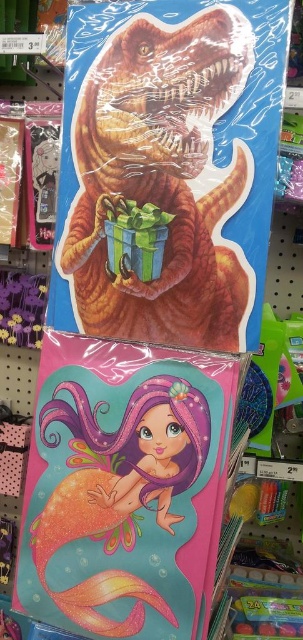
Question: Observing the image, what is the correct spatial positioning of shiny plastic dinosaur at center in reference to shiny orange mermaid at lower left?

Choices:
 (A) below
 (B) above

Answer: (B)

Question: Among these points, which one is farthest from the camera?

Choices:
 (A) [x=87, y=300]
 (B) [x=157, y=509]

Answer: (A)

Question: Which point appears farthest from the camera in this image?

Choices:
 (A) (73, 442)
 (B) (149, 310)

Answer: (A)

Question: Which of the following is the farthest from the observer?

Choices:
 (A) (52, 547)
 (B) (186, 65)

Answer: (A)

Question: Can you confirm if shiny plastic dinosaur at center is positioned below shiny orange mermaid at lower left?

Choices:
 (A) yes
 (B) no

Answer: (B)

Question: Is shiny plastic dinosaur at center closer to camera compared to shiny orange mermaid at lower left?

Choices:
 (A) yes
 (B) no

Answer: (A)